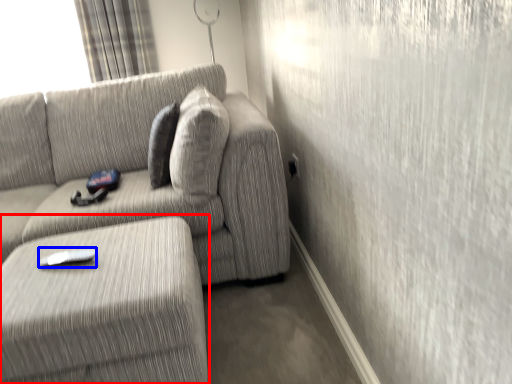
Question: Which point is further to the camera, table (highlighted by a red box) or remote (highlighted by a blue box)?

Choices:
 (A) table
 (B) remote

Answer: (B)